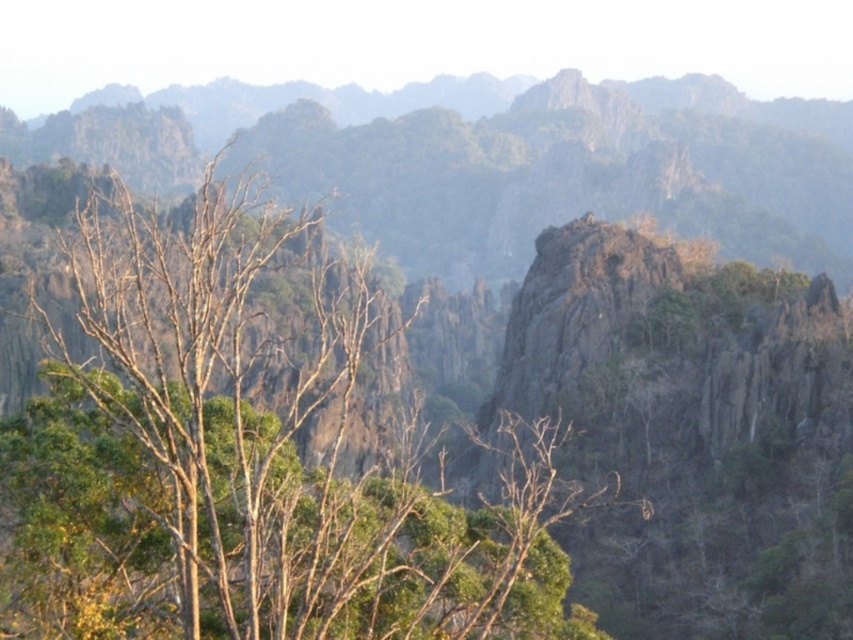
Does green leafy tree at center appear over rugged gray rock at center?

Incorrect, green leafy tree at center is not positioned above rugged gray rock at center.

Is point (532, 579) positioned behind point (293, 128)?

No, (532, 579) is closer to viewer.

Identify the location of green leafy tree at center. The height and width of the screenshot is (640, 853). coord(253,451).

Identify the location of green leafy tree at center. The image size is (853, 640). (253, 451).

Can you confirm if green leafy tree at center is wider than rough gray rock at center?

Yes, green leafy tree at center is wider than rough gray rock at center.

Which of these two, green leafy tree at center or rough gray rock at center, stands taller?

Standing taller between the two is green leafy tree at center.

Locate an element on the screen. green leafy tree at center is located at coordinates (253, 451).

Is rough gray rock at center to the right of rugged gray rock at center from the viewer's perspective?

Indeed, rough gray rock at center is positioned on the right side of rugged gray rock at center.

Can you confirm if rough gray rock at center is smaller than rugged gray rock at center?

Yes.

Who is more distant from viewer, (666, 291) or (270, 90)?

Positioned behind is point (270, 90).

Locate an element on the screen. The height and width of the screenshot is (640, 853). rough gray rock at center is located at coordinates (692, 432).